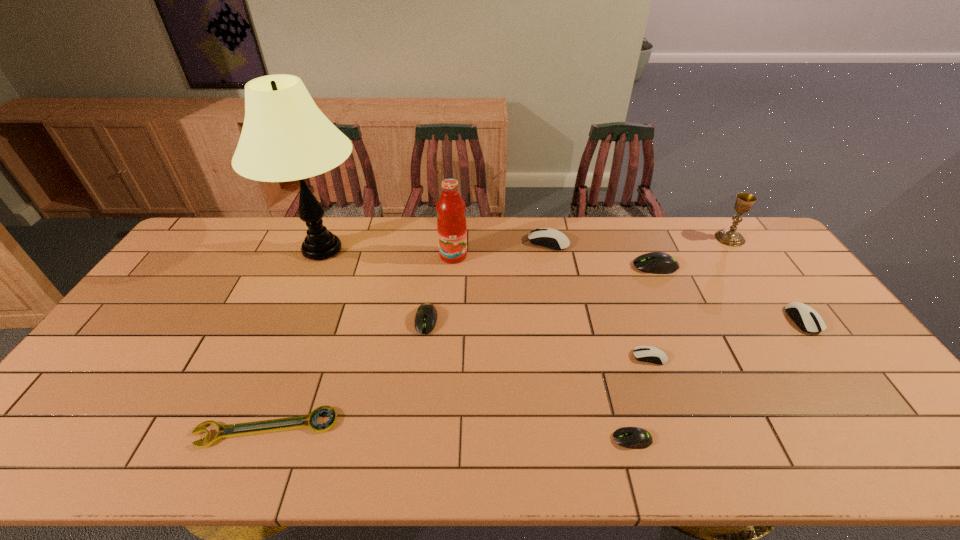
The image size is (960, 540). In order to click on free point between the black lamp and the shortest object in this screenshot , I will do `click(295, 339)`.

At what (x,y) coordinates should I click in order to perform the action: click on free space between the ninth shortest object and the second white mouse from left to right. Please return your answer as a coordinate pair (x, y). Looking at the image, I should click on (551, 306).

Identify the location of vacant area between the wrench and the biggest white mouse. Image resolution: width=960 pixels, height=540 pixels. (407, 335).

Locate an element on the screen. vacant space that is in between the wrench and the fifth computer mouse from left to right is located at coordinates (461, 347).

I want to click on empty location between the nearest computer mouse and the second biggest white mouse, so click(717, 380).

Image resolution: width=960 pixels, height=540 pixels. I want to click on the second closest object to the leftmost gray computer mouse, so 285,137.

Point out which object is positioned as the second nearest to the second gray computer mouse from left to right. Please provide its 2D coordinates. Your answer should be formatted as a tuple, i.e. [(x, y)], where the tuple contains the x and y coordinates of a point satisfying the conditions above.

[(426, 316)]

Select which computer mouse appears as the fifth closest to the wrench. Please provide its 2D coordinates. Your answer should be formatted as a tuple, i.e. [(x, y)], where the tuple contains the x and y coordinates of a point satisfying the conditions above.

[(655, 262)]

Find the location of a particular element. This screenshot has width=960, height=540. computer mouse that stands as the fourth closest to the smallest gray computer mouse is located at coordinates (806, 318).

At what (x,y) coordinates should I click in order to perform the action: click on white mouse identified as the closest to the leftmost gray computer mouse. Please return your answer as a coordinate pair (x, y). The image size is (960, 540). Looking at the image, I should click on coord(550,238).